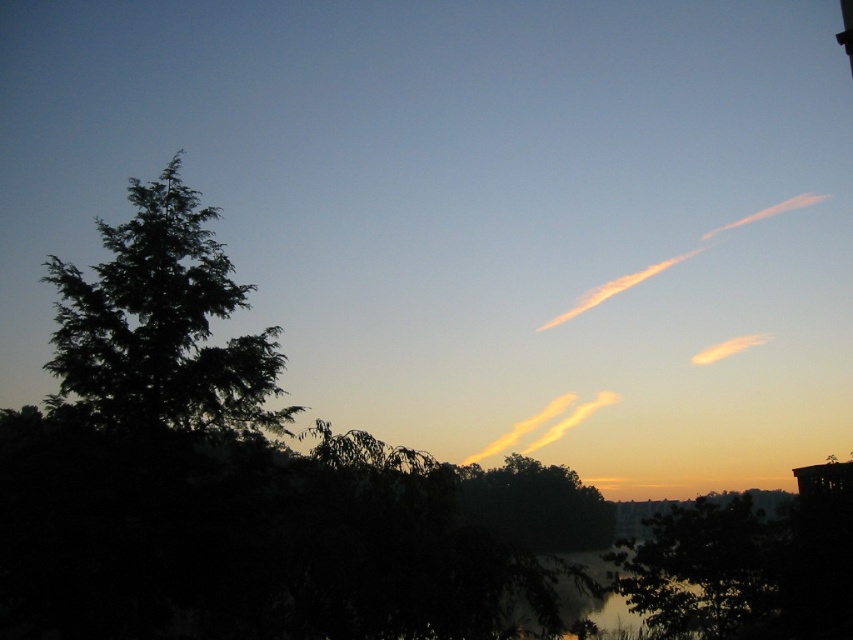
Who is shorter, dark green leafy tree at left or translucent orange cloud at center?

Standing shorter between the two is translucent orange cloud at center.

Between point (135, 241) and point (554, 435), which one is positioned behind?

Positioned behind is point (554, 435).

Is point (161, 182) closer to viewer compared to point (564, 403)?

Yes, it is in front of point (564, 403).

The height and width of the screenshot is (640, 853). Identify the location of dark green leafy tree at left. (161, 323).

What are the coordinates of `pastel pink cotton cloud at upper right` in the screenshot? It's located at (674, 259).

Which is in front, point (699, 250) or point (706, 349)?

Point (699, 250) is more forward.

Is point (804, 204) positioned after point (709, 348)?

Yes.

Locate an element on the screen. This screenshot has height=640, width=853. pastel pink cotton cloud at upper right is located at coordinates pos(674,259).

Based on the photo, can you confirm if glossy reflective water at lower center is smaller than translucent orange cloud at center?

Incorrect, glossy reflective water at lower center is not smaller in size than translucent orange cloud at center.

Where is `glossy reflective water at lower center`? The height and width of the screenshot is (640, 853). glossy reflective water at lower center is located at coordinates (590, 593).